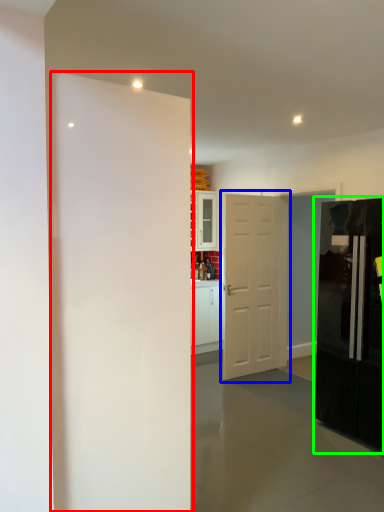
Question: Based on their relative distances, which object is farther from door (highlighted by a red box)? Choose from door (highlighted by a blue box) and refrigerator (highlighted by a green box).

Choices:
 (A) door
 (B) refrigerator

Answer: (A)